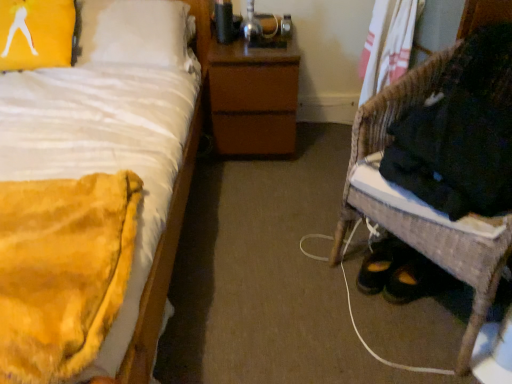
Describe the element at coordinates (255, 89) in the screenshot. I see `brown matte nightstand at center` at that location.

What do you see at coordinates (118, 142) in the screenshot? I see `yellow plush blanket at left` at bounding box center [118, 142].

At what (x,y) coordinates should I click in order to perform the action: click on yellow fabric pillow at upper left. Please return your answer as a coordinate pair (x, y). Looking at the image, I should click on (36, 33).

Locate an element on the screen. woven wicker chair at lower right is located at coordinates (420, 217).

This screenshot has width=512, height=384. Identify the location of brown matte nightstand at center. (255, 89).

In the scene shown: Is woven wicker chair at lower right to the left or to the right of yellow plush blanket at left in the image?

woven wicker chair at lower right is to the right of yellow plush blanket at left.

Considering the relative positions of woven wicker chair at lower right and yellow plush blanket at left in the image provided, is woven wicker chair at lower right in front of yellow plush blanket at left?

No, woven wicker chair at lower right is further to the viewer.

Identify the location of bed above the woven wicker chair at lower right (from the image's perspective). The width and height of the screenshot is (512, 384). (118, 142).

Which is nearer, (469, 257) or (182, 25)?

Clearly, point (469, 257) is closer to the camera than point (182, 25).

Considering the relative sizes of woven wicker chair at lower right and yellow fabric pillow at upper left in the image provided, is woven wicker chair at lower right thinner than yellow fabric pillow at upper left?

In fact, woven wicker chair at lower right might be wider than yellow fabric pillow at upper left.

Between point (490, 297) and point (24, 69), which one is positioned behind?

The point (24, 69) is farther.

What's the angular difference between woven wicker chair at lower right and yellow fabric pillow at upper left's facing directions?

woven wicker chair at lower right and yellow fabric pillow at upper left are facing 49.8 degrees away from each other.

Based on their positions, is woven wicker chair at lower right located to the left or right of yellow fabric pillow at upper left?

In the image, woven wicker chair at lower right appears on the right side of yellow fabric pillow at upper left.

Does woven wicker chair at lower right appear on the right side of brown matte nightstand at center?

Yes.

You are a GUI agent. You are given a task and a screenshot of the screen. Output one action in this format:
    pyautogui.click(x=<x>, y=<y>)
    Task: Click on the furniture in front of the brown matte nightstand at center
    This screenshot has width=512, height=384.
    Given the screenshot: What is the action you would take?
    pyautogui.click(x=420, y=217)

Measure the distance from woven wicker chair at lower right to brown matte nightstand at center.

They are 32.27 inches apart.

From the picture: Is woven wicker chair at lower right positioned with its back to brown matte nightstand at center?

woven wicker chair at lower right is not turned away from brown matte nightstand at center.

In the scene shown: Considering the positions of objects yellow fabric pillow at upper left and brown matte nightstand at center in the image provided, who is in front, yellow fabric pillow at upper left or brown matte nightstand at center?

yellow fabric pillow at upper left is more forward.

Could you tell me if yellow fabric pillow at upper left is turned towards brown matte nightstand at center?

No, yellow fabric pillow at upper left is not turned towards brown matte nightstand at center.

Which is correct: yellow fabric pillow at upper left is inside brown matte nightstand at center, or outside of it?

yellow fabric pillow at upper left lies outside brown matte nightstand at center.

Which is in front, point (5, 64) or point (477, 262)?

Point (477, 262)

Is there a large distance between yellow fabric pillow at upper left and woven wicker chair at lower right?

Indeed, yellow fabric pillow at upper left is not near woven wicker chair at lower right.

Between yellow fabric pillow at upper left and woven wicker chair at lower right, which one is positioned behind?

yellow fabric pillow at upper left is further from the camera.

From the image's perspective, is brown matte nightstand at center located above or below woven wicker chair at lower right?

Clearly, from the image's perspective, brown matte nightstand at center is above woven wicker chair at lower right.

How different are the orientations of brown matte nightstand at center and woven wicker chair at lower right in degrees?

The facing directions of brown matte nightstand at center and woven wicker chair at lower right are 60.5 degrees apart.

From a real-world perspective, which is physically below, brown matte nightstand at center or woven wicker chair at lower right?

In real-world perspective, brown matte nightstand at center is lower.

Could you tell me if brown matte nightstand at center is facing woven wicker chair at lower right?

No, brown matte nightstand at center is not aimed at woven wicker chair at lower right.

Is yellow fabric pillow at upper left aimed at yellow plush blanket at left?

Yes, yellow fabric pillow at upper left is facing yellow plush blanket at left.

Is yellow fabric pillow at upper left smaller than yellow plush blanket at left?

Indeed, yellow fabric pillow at upper left has a smaller size compared to yellow plush blanket at left.

The height and width of the screenshot is (384, 512). In order to click on pillow that appears above the yellow plush blanket at left (from the image's perspective) in this screenshot , I will do `click(36, 33)`.

From a real-world perspective, which is physically above, yellow fabric pillow at upper left or yellow plush blanket at left?

In real-world perspective, yellow fabric pillow at upper left is above.

What are the coordinates of `furniture below the yellow plush blanket at left (from a real-world perspective)` in the screenshot? It's located at (420, 217).

Where is `furniture on the right side of yellow fabric pillow at upper left`? furniture on the right side of yellow fabric pillow at upper left is located at coordinates (420, 217).

Considering their positions, is yellow plush blanket at left positioned closer to woven wicker chair at lower right than brown matte nightstand at center?

brown matte nightstand at center lies closer to woven wicker chair at lower right than the other object.

Considering their positions, is yellow fabric pillow at upper left positioned closer to brown matte nightstand at center than woven wicker chair at lower right?

Based on the image, yellow fabric pillow at upper left appears to be nearer to brown matte nightstand at center.

When comparing their distances from woven wicker chair at lower right, does yellow fabric pillow at upper left or brown matte nightstand at center seem further?

yellow fabric pillow at upper left lies further to woven wicker chair at lower right than the other object.

Looking at this image, which object lies further to the anchor point yellow plush blanket at left, brown matte nightstand at center or woven wicker chair at lower right?

woven wicker chair at lower right lies further to yellow plush blanket at left than the other object.

When comparing their distances from yellow plush blanket at left, does brown matte nightstand at center or yellow fabric pillow at upper left seem further?

brown matte nightstand at center.

Looking at the image, which one is located further to yellow plush blanket at left, yellow fabric pillow at upper left or brown matte nightstand at center?

The object further to yellow plush blanket at left is brown matte nightstand at center.

Which object lies nearer to the anchor point yellow plush blanket at left, yellow fabric pillow at upper left or woven wicker chair at lower right?

The object closer to yellow plush blanket at left is yellow fabric pillow at upper left.

Estimate the real-world distances between objects in this image. Which object is closer to woven wicker chair at lower right, yellow fabric pillow at upper left or yellow plush blanket at left?

yellow plush blanket at left.

Identify the location of bed between yellow fabric pillow at upper left and woven wicker chair at lower right from left to right. (118, 142).

This screenshot has height=384, width=512. I want to click on pillow between yellow plush blanket at left and brown matte nightstand at center in the front-back direction, so click(36, 33).

At what (x,y) coordinates should I click in order to perform the action: click on nightstand between yellow fabric pillow at upper left and woven wicker chair at lower right in the horizontal direction. Please return your answer as a coordinate pair (x, y). This screenshot has height=384, width=512. Looking at the image, I should click on (255, 89).

This screenshot has height=384, width=512. I want to click on furniture located between yellow plush blanket at left and brown matte nightstand at center in the depth direction, so click(420, 217).